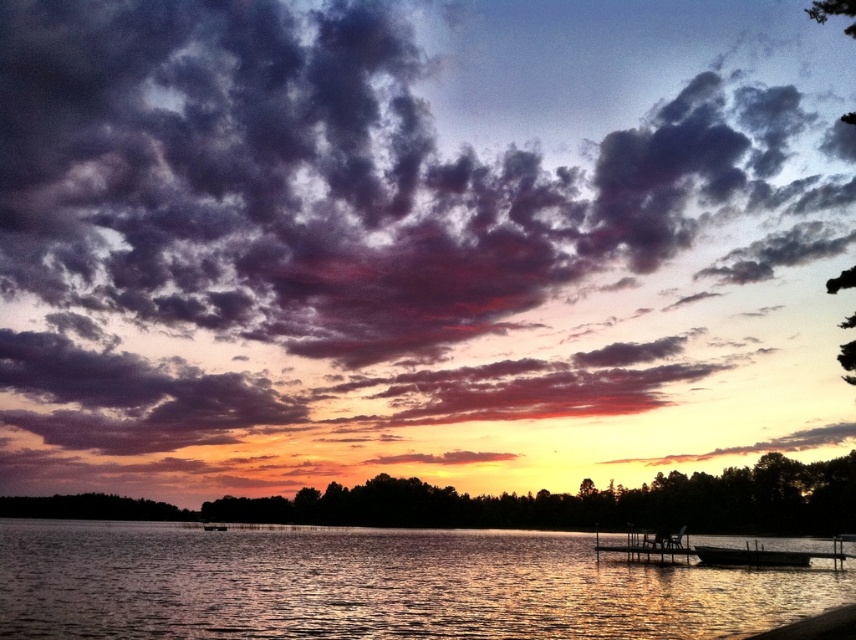
Between glistening water at center and silvery metallic dock at lower right, which one is positioned lower?

glistening water at center is below.

Who is positioned more to the right, glistening water at center or silvery metallic dock at lower right?

silvery metallic dock at lower right is more to the right.

Where is `glistening water at center`? This screenshot has height=640, width=856. glistening water at center is located at coordinates (375, 584).

Where is `glistening water at center`? glistening water at center is located at coordinates (375, 584).

Between glistening water at center and wooden park bench at lower right, which one has more height?

Standing taller between the two is glistening water at center.

Does glistening water at center have a lesser width compared to wooden park bench at lower right?

Incorrect, glistening water at center's width is not less than wooden park bench at lower right's.

Identify the location of glistening water at center. The height and width of the screenshot is (640, 856). (375, 584).

Where is `glistening water at center`? The height and width of the screenshot is (640, 856). glistening water at center is located at coordinates (375, 584).

Is silvery metallic dock at lower right below wooden park bench at lower right?

Yes.

This screenshot has width=856, height=640. In order to click on silvery metallic dock at lower right in this screenshot , I will do `click(715, 550)`.

What do you see at coordinates (715, 550) in the screenshot? This screenshot has width=856, height=640. I see `silvery metallic dock at lower right` at bounding box center [715, 550].

The height and width of the screenshot is (640, 856). I want to click on silvery metallic dock at lower right, so click(715, 550).